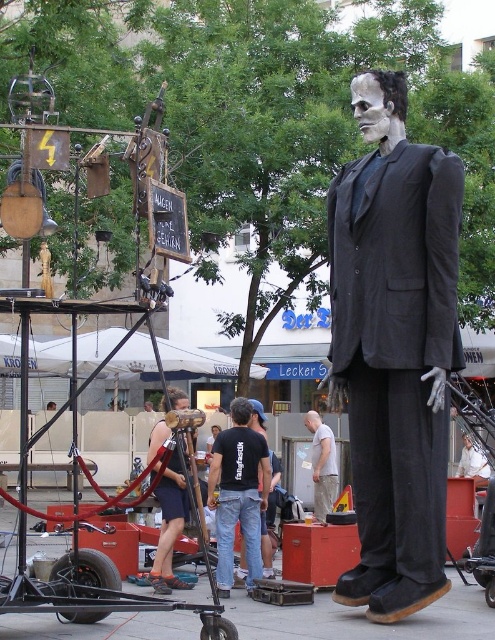
You are a performer preparing to give a speech. You see the matte black suit at center and the wooden microphone at center. Which object is taller and should you adjust your stand position accordingly?

The matte black suit at center is taller than the wooden microphone at center. Since the suit is taller, you should position yourself closer to it to ensure visibility and maintain a balanced appearance during your speech.